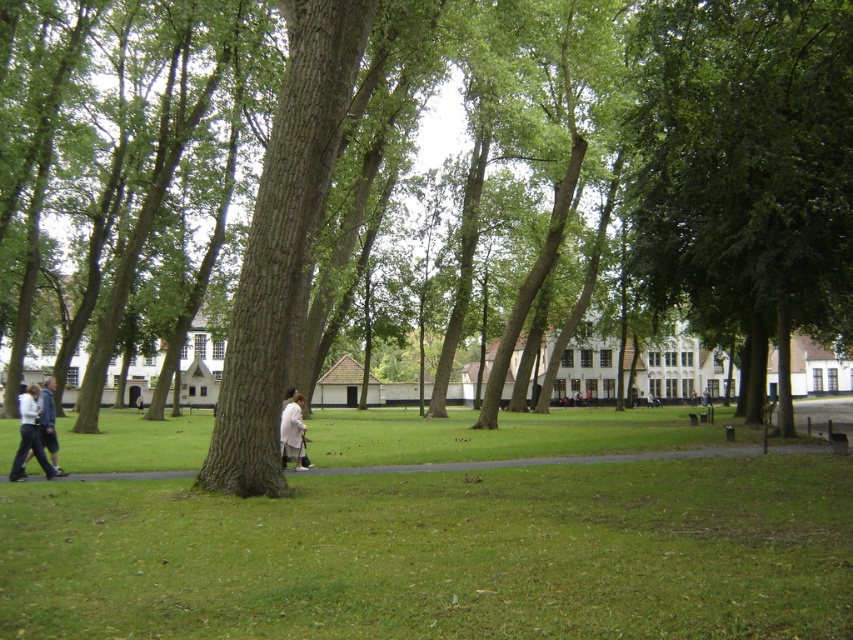
Can you confirm if white cotton jacket at lower left is wider than light beige fabric coat at center?

Correct, the width of white cotton jacket at lower left exceeds that of light beige fabric coat at center.

Is point (47, 417) less distant than point (280, 428)?

Yes, it is.

Where is `white cotton jacket at lower left`? This screenshot has width=853, height=640. white cotton jacket at lower left is located at coordinates (36, 432).

Where is `green rough bark tree at center`? The image size is (853, 640). green rough bark tree at center is located at coordinates (674, 160).

From the picture: Can you confirm if green rough bark tree at center is positioned to the right of green grass at lower center?

Correct, you'll find green rough bark tree at center to the right of green grass at lower center.

In order to click on green rough bark tree at center in this screenshot , I will do `click(674, 160)`.

Where is `green rough bark tree at center`? Image resolution: width=853 pixels, height=640 pixels. green rough bark tree at center is located at coordinates (674, 160).

Can you confirm if green grass at lower center is taller than white cotton jacket at lower left?

Correct, green grass at lower center is much taller as white cotton jacket at lower left.

What do you see at coordinates (440, 554) in the screenshot?
I see `green grass at lower center` at bounding box center [440, 554].

Between point (434, 614) and point (30, 392), which one is positioned in front?

Point (434, 614) is in front.

Where is `green grass at lower center`? green grass at lower center is located at coordinates (x=440, y=554).